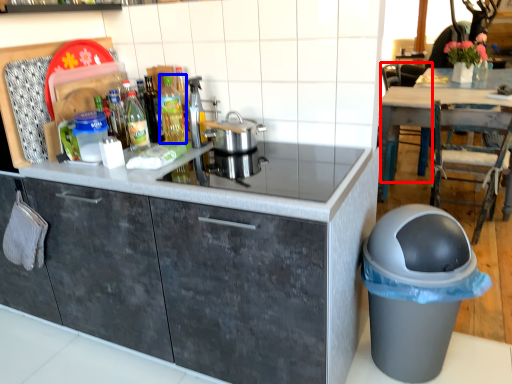
Question: Which object appears farthest to the camera in this image, chair (highlighted by a red box) or bottle (highlighted by a blue box)?

Choices:
 (A) chair
 (B) bottle

Answer: (A)